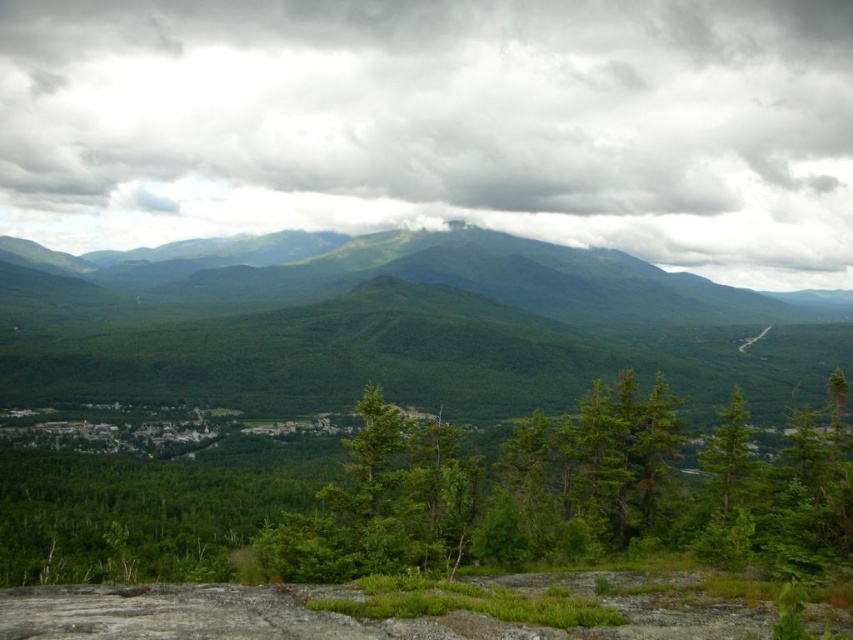
Question: Which of the following is the farthest from the observer?

Choices:
 (A) cloudy sky at upper center
 (B) green matte tree at center

Answer: (A)

Question: Does cloudy sky at upper center come behind green matte tree at center?

Choices:
 (A) no
 (B) yes

Answer: (B)

Question: Can you confirm if cloudy sky at upper center is smaller than green matte tree at center?

Choices:
 (A) no
 (B) yes

Answer: (A)

Question: Where is cloudy sky at upper center located in relation to green matte tree at center in the image?

Choices:
 (A) right
 (B) left

Answer: (B)

Question: Which of the following is the farthest from the observer?

Choices:
 (A) click(x=413, y=552)
 (B) click(x=173, y=6)

Answer: (B)